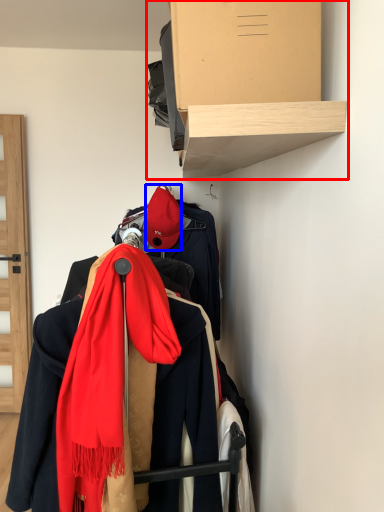
Question: Which object is closer to the camera taking this photo, shelf (highlighted by a red box) or hat (highlighted by a blue box)?

Choices:
 (A) shelf
 (B) hat

Answer: (A)